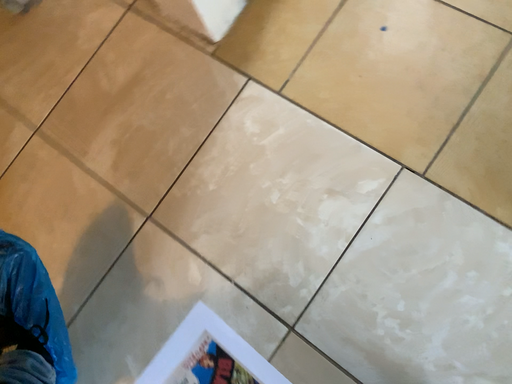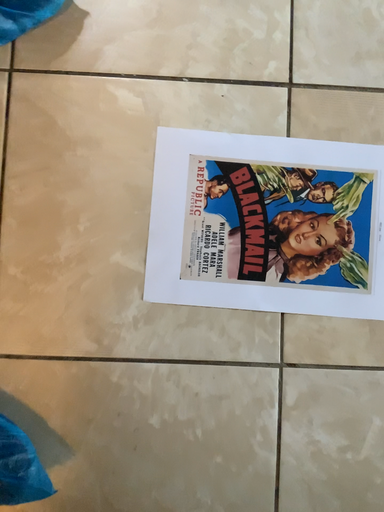
Question: How did the camera likely rotate when shooting the video?

Choices:
 (A) rotated right
 (B) rotated left

Answer: (A)